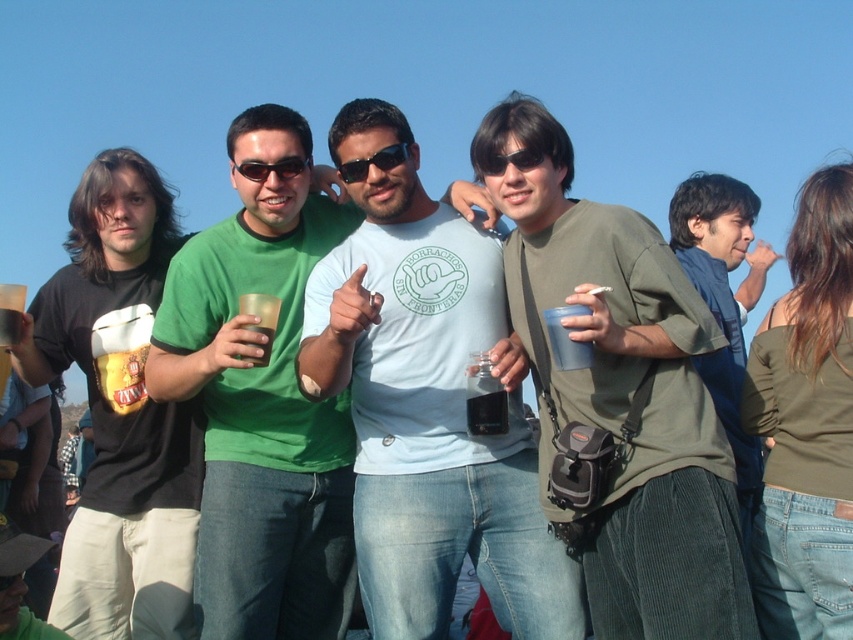
Based on the coordinates provided, which object is located at point [120,410] in the scene?

The point [120,410] corresponds to the matte black t shirt at left.